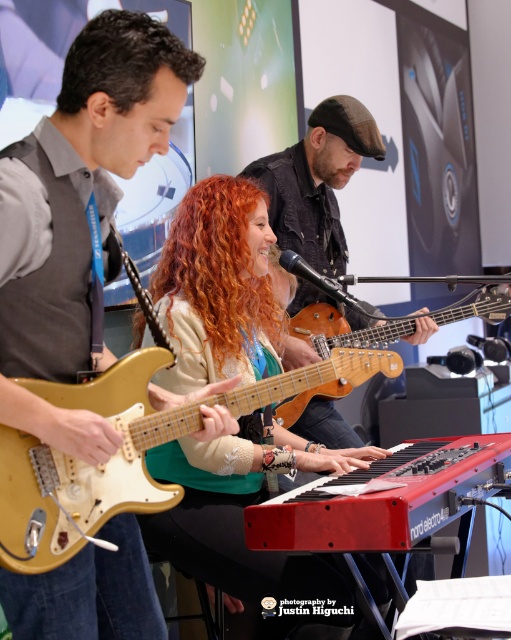
You are a photographer setting up for a live music session. You need to place a microphone stand between the matte gold guitar at center and the gold wood guitar at center. Based on their sizes, which guitar should you position closer to the microphone to ensure the stand fits comfortably?

The matte gold guitar at center is thinner than the gold wood guitar at center, so positioning the matte gold guitar closer to the microphone stand would allow more space between the guitars, ensuring the stand fits comfortably.

You are a photographer at the event and want to capture a closeup of the matte gold guitar at left and the dark brown curly hair at upper left in the same frame. Which object should you focus on first if you want to ensure both are in focus?

The matte gold guitar at left is wider than the dark brown curly hair at upper left, so you should focus on the matte gold guitar at left first to ensure both are in focus.

You are a photographer at the music event and want to capture a closeup shot of the musician playing the keyboard. To ensure both the matte gold guitar at left and the dark brown curly hair at upper left are visible in the frame, which object should you position closer to the camera?

The matte gold guitar at left is larger than the dark brown curly hair at upper left, so positioning the matte gold guitar at left closer to the camera will ensure both objects are visible in the frame without one being too small.